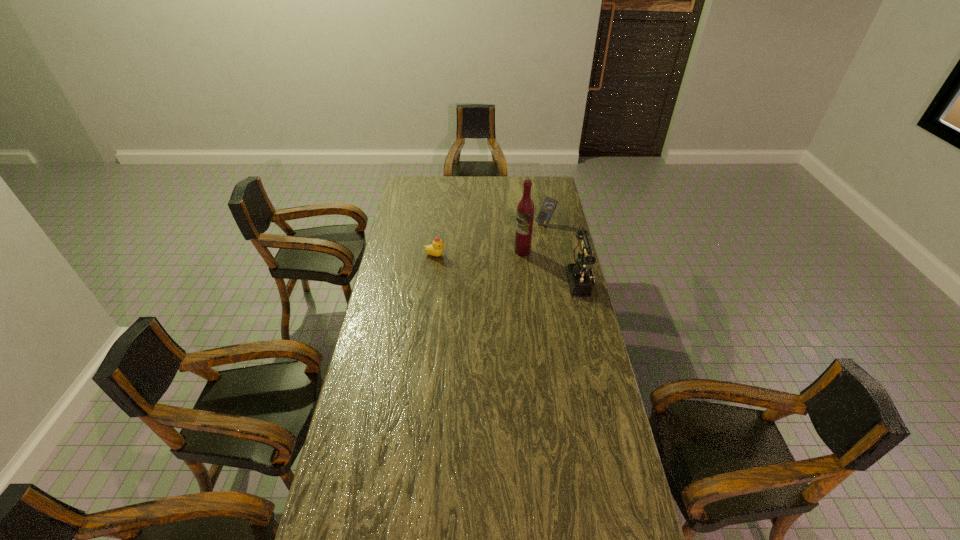
Image resolution: width=960 pixels, height=540 pixels. What are the coordinates of `vacant area located on the front-facing side of the farthest object` in the screenshot? It's located at (531, 234).

This screenshot has width=960, height=540. Identify the location of vacant space located 0.120m on the front-facing side of the farthest object. (528, 238).

You are a GUI agent. You are given a task and a screenshot of the screen. Output one action in this format:
    pyautogui.click(x=<x>, y=<y>)
    Task: Click on the vacant space located on the label of the second object from left to right
    The width and height of the screenshot is (960, 540).
    Given the screenshot: What is the action you would take?
    pyautogui.click(x=481, y=265)

Find the location of a particular element. vacant space situated on the label of the second object from left to right is located at coordinates (491, 262).

What are the coordinates of `vacant space located 0.400m on the label of the second object from left to right` in the screenshot? It's located at (441, 279).

This screenshot has height=540, width=960. Identify the location of telephone present at the right edge. (580, 278).

Find the location of a particular element. The height and width of the screenshot is (540, 960). calculator that is at the right edge is located at coordinates (548, 206).

The height and width of the screenshot is (540, 960). Identify the location of free space at the far edge. (442, 188).

In the image, there is a desktop. Where is `free region at the left edge`? free region at the left edge is located at coordinates (407, 313).

Where is `free space at the right edge`? This screenshot has width=960, height=540. free space at the right edge is located at coordinates (593, 466).